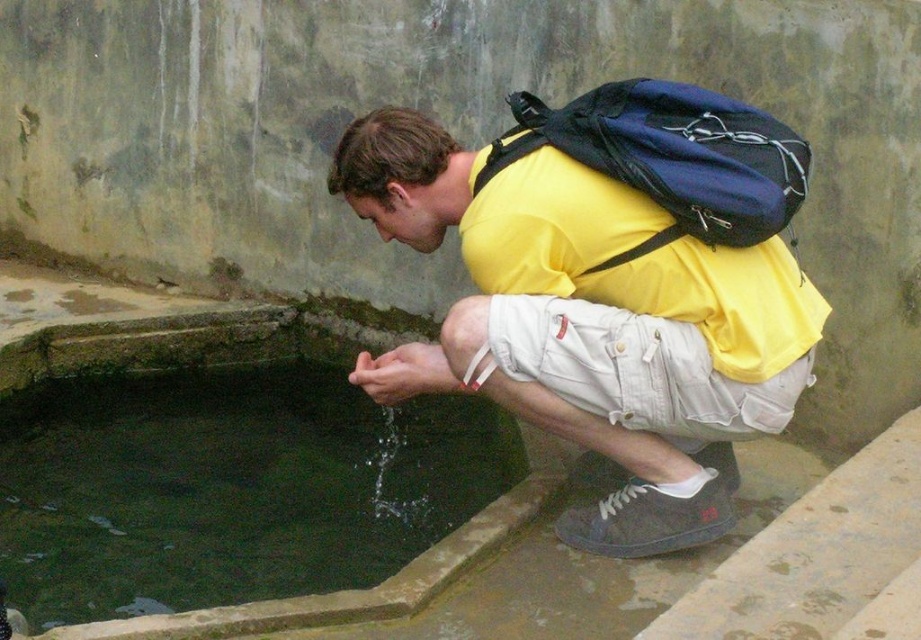
You are a photographer trying to capture the scene of the person drinking water. You want to ensure both the yellow matte shirt at center and the green stone pool at lower left are clearly visible in your photo. Which object should you focus on first to ensure proper framing?

The yellow matte shirt at center is smaller than the green stone pool at lower left, so you should focus on the green stone pool at lower left first to ensure it is properly framed in the photo.

You are a hiker who needs to refill your water bottle. You see the green stone pool at lower left and the white denim shorts at lower center. Which object can you use to hold water?

The green stone pool at lower left can hold water as it is larger in size than the white denim shorts at lower center.

You are a photographer trying to capture the scene of the person drinking from the water basin. You need to ensure that the yellow matte shirt at center and the green stone pool at lower left are both visible in the frame. Based on their sizes, which object should you focus on to ensure both are in focus?

The yellow matte shirt at center is taller than the green stone pool at lower left, so focusing on the yellow matte shirt at center would ensure both are in focus since it is larger and closer to the camera.